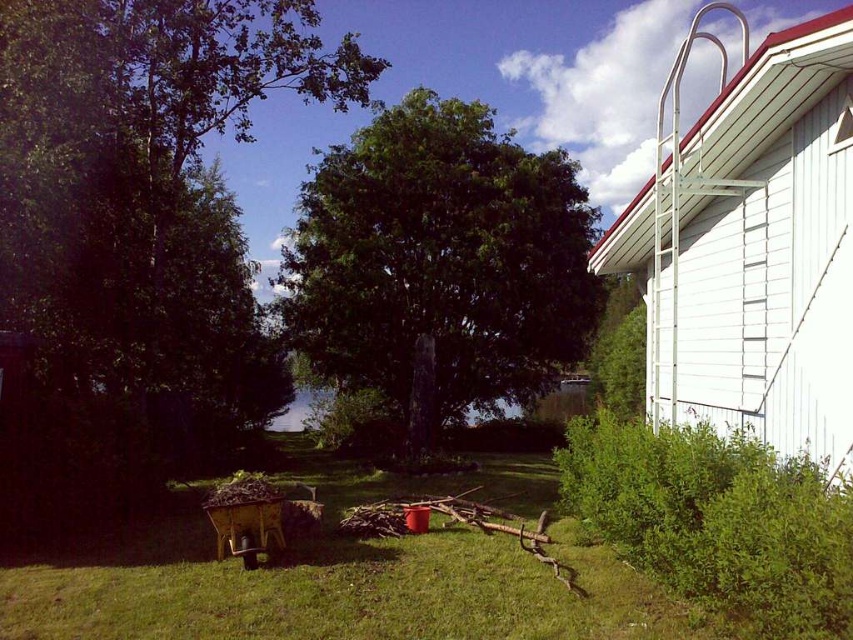
You are standing in the garden and want to place a new flower pot exactly at the center of the image. The white wooden ladder at upper right is currently occupying part of that area. Can you estimate whether the ladder is positioned to the left or right of the image center?

The 2D location of white wooden ladder at upper right is at point (x=753, y=248). Since the x coordinate is 0.388, which is less than 0.5, the ladder is positioned to the left of the image center.

You are standing in the backyard and want to take a photo of both the green leafy tree at left and the green leafy tree at center. Which tree should you position yourself closer to in order to capture both in the frame?

To capture both the green leafy tree at left and the green leafy tree at center in the frame, you should position yourself closer to the green leafy tree at center since the green leafy tree at left is above it, meaning it is taller and might dominate the upper part of the frame, requiring a wider angle or closer proximity to the shorter tree to include both.

You are standing in the backyard and want to reach the top of the white wooden ladder at upper right to retrieve a tool. However, there is a green leafy tree at center in your path. Based on their positions, can you safely walk straight towards the ladder without encountering the tree?

The white wooden ladder at upper right is closer to the viewer than the green leafy tree at center, so you can safely walk straight towards the ladder without encountering the tree because the tree is farther away and likely behind you as you move toward the ladder.